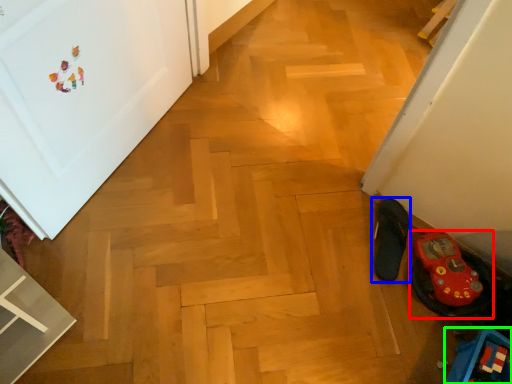
Question: Which is farther away from footwear (highlighted by a red box)? footwear (highlighted by a blue box) or toy (highlighted by a green box)?

Choices:
 (A) footwear
 (B) toy

Answer: (B)